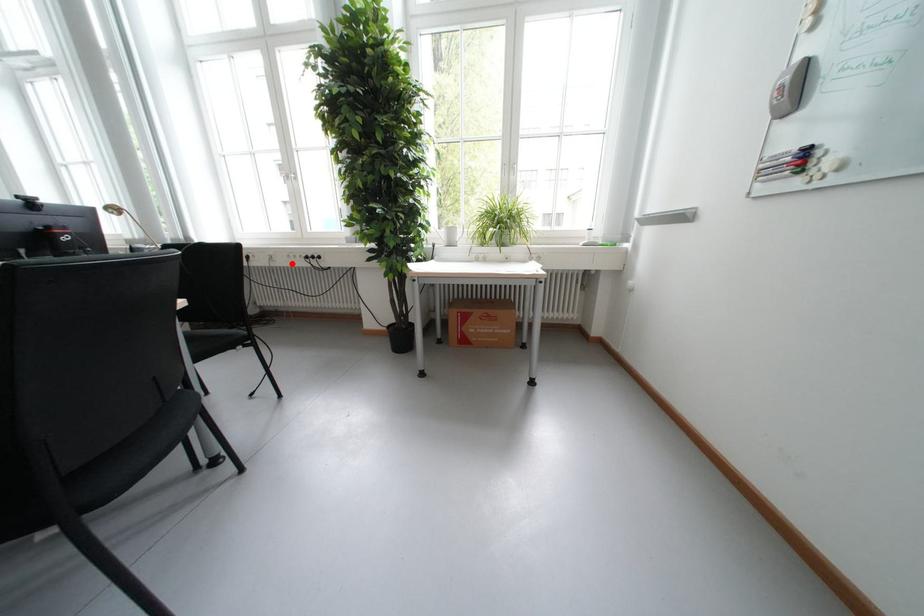
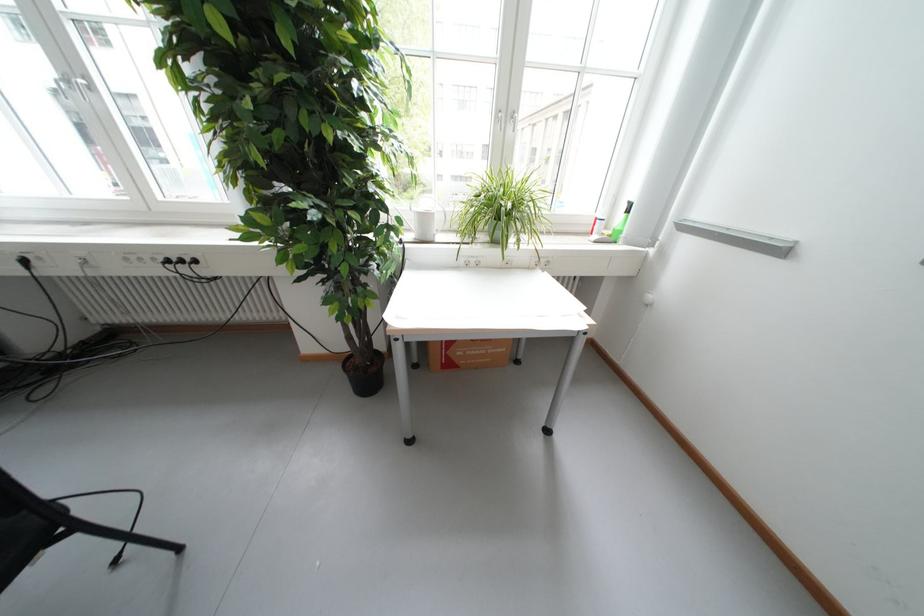
Question: I am providing you with two images of the same scene from different viewpoints. Image1 has a red point marked. In image2, the corresponding 3D location appears at what relative position? Reply with the corresponding letter.

Choices:
 (A) Closer
 (B) Farther

Answer: (B)